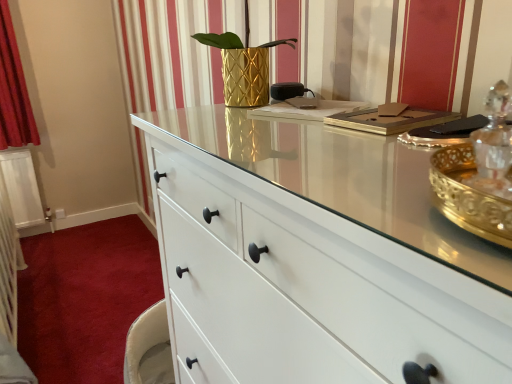
What is the approximate height of gold textured vase at center?

gold textured vase at center is 11.12 inches in height.

The image size is (512, 384). Identify the location of gold textured vase at center. (243, 66).

The image size is (512, 384). What do you see at coordinates (243, 66) in the screenshot?
I see `gold textured vase at center` at bounding box center [243, 66].

Measure the distance between white matte drawer at lower left and camera.

white matte drawer at lower left and camera are 1.91 meters apart from each other.

Describe the element at coordinates (85, 298) in the screenshot. I see `white matte drawer at lower left` at that location.

I want to click on white matte drawer at lower left, so click(85, 298).

At what (x,y) coordinates should I click in order to perform the action: click on gold textured vase at center. Please return your answer as a coordinate pair (x, y). The width and height of the screenshot is (512, 384). Looking at the image, I should click on (243, 66).

Between white matte drawer at lower left and gold textured vase at center, which one appears on the right side from the viewer's perspective?

Positioned to the right is gold textured vase at center.

Which is in front, white matte drawer at lower left or gold textured vase at center?

gold textured vase at center is closer to the camera.

Considering the points (140, 224) and (224, 71), which point is in front, point (140, 224) or point (224, 71)?

The point (224, 71) is more forward.

From the image's perspective, does white matte drawer at lower left appear higher than gold textured vase at center?

Actually, white matte drawer at lower left appears below gold textured vase at center in the image.

From a real-world perspective, between white matte drawer at lower left and gold textured vase at center, who is vertically higher?

From a 3D spatial view, gold textured vase at center is above.

In the scene shown: Between white matte drawer at lower left and gold textured vase at center, which one has larger width?

Wider between the two is white matte drawer at lower left.

Who is taller, white matte drawer at lower left or gold textured vase at center?

gold textured vase at center is taller.

From the picture: Is white matte drawer at lower left bigger than gold textured vase at center?

Indeed, white matte drawer at lower left has a larger size compared to gold textured vase at center.

Is white matte drawer at lower left not within gold textured vase at center?

Yes, white matte drawer at lower left is outside of gold textured vase at center.

Would you consider white matte drawer at lower left to be distant from gold textured vase at center?

white matte drawer at lower left is positioned a significant distance from gold textured vase at center.

Is white matte drawer at lower left facing away from gold textured vase at center?

white matte drawer at lower left does not have its back to gold textured vase at center.

Can you tell me how much white matte drawer at lower left and gold textured vase at center differ in facing direction?

There is a 87.2-degree angle between the facing directions of white matte drawer at lower left and gold textured vase at center.

How distant is white matte drawer at lower left from gold textured vase at center?

white matte drawer at lower left is 5.85 feet away from gold textured vase at center.

Where is `plain lying behind the gold textured vase at center`? This screenshot has height=384, width=512. plain lying behind the gold textured vase at center is located at coordinates (85, 298).

Which is more to the left, gold textured vase at center or white matte drawer at lower left?

Positioned to the left is white matte drawer at lower left.

Does gold textured vase at center lie in front of white matte drawer at lower left?

Yes, gold textured vase at center is in front of white matte drawer at lower left.

Which is nearer, (263, 88) or (85, 295)?

Point (263, 88) is closer to the camera than point (85, 295).

From the image's perspective, which is above, gold textured vase at center or white matte drawer at lower left?

gold textured vase at center.

From a real-world perspective, which is physically below, gold textured vase at center or white matte drawer at lower left?

white matte drawer at lower left, from a real-world perspective.

Can you confirm if gold textured vase at center is thinner than white matte drawer at lower left?

Yes, gold textured vase at center is thinner than white matte drawer at lower left.

Who is taller, gold textured vase at center or white matte drawer at lower left?

Standing taller between the two is gold textured vase at center.

Between gold textured vase at center and white matte drawer at lower left, which one has larger size?

With larger size is white matte drawer at lower left.

Is gold textured vase at center inside the boundaries of white matte drawer at lower left, or outside?

gold textured vase at center is not inside white matte drawer at lower left, it's outside.

Is gold textured vase at center in contact with white matte drawer at lower left?

There is a gap between gold textured vase at center and white matte drawer at lower left.

Is gold textured vase at center facing towards white matte drawer at lower left?

No, gold textured vase at center is not oriented towards white matte drawer at lower left.

Can you tell me how much gold textured vase at center and white matte drawer at lower left differ in facing direction?

The facing directions of gold textured vase at center and white matte drawer at lower left are 87.2 degrees apart.

At what (x,y) coordinates should I click in order to perform the action: click on plain that appears behind the gold textured vase at center. Please return your answer as a coordinate pair (x, y). Image resolution: width=512 pixels, height=384 pixels. Looking at the image, I should click on (85, 298).

Identify the location of plain behind the gold textured vase at center. The image size is (512, 384). (85, 298).

This screenshot has height=384, width=512. I want to click on plant lying in front of the white matte drawer at lower left, so pos(243,66).